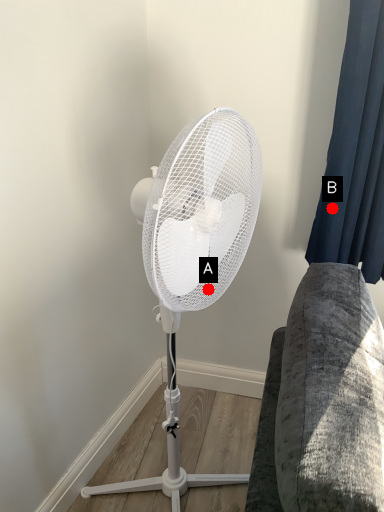
Question: Two points are circled on the image, labeled by A and B beside each circle. Which of the following is the closest to the observer?

Choices:
 (A) A is closer
 (B) B is closer

Answer: (A)